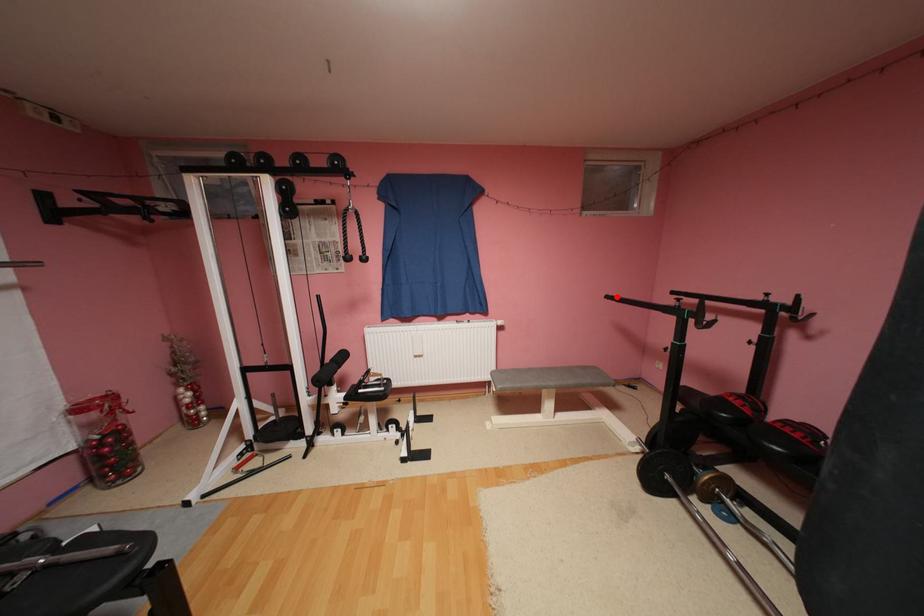
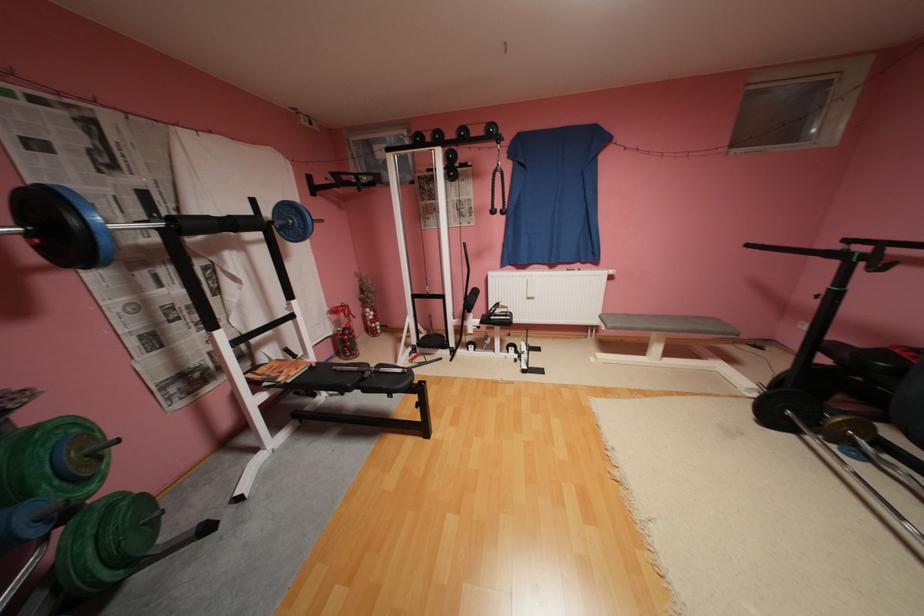
Question: I am providing you with two images of the same scene from different viewpoints. A red point is marked on the first image. At the location where the point appears in image 1, is it still visible in image 2?

Choices:
 (A) Yes
 (B) No

Answer: (A)